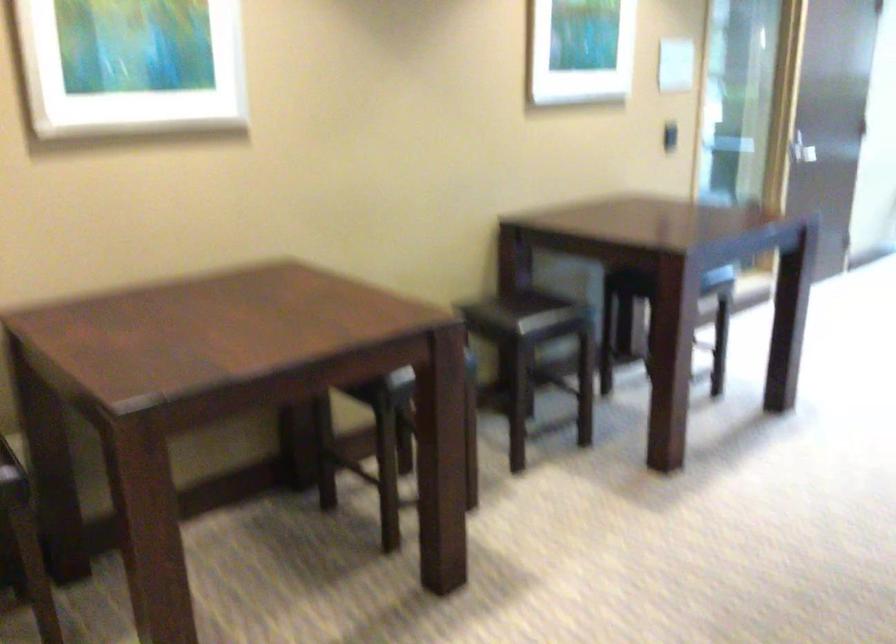
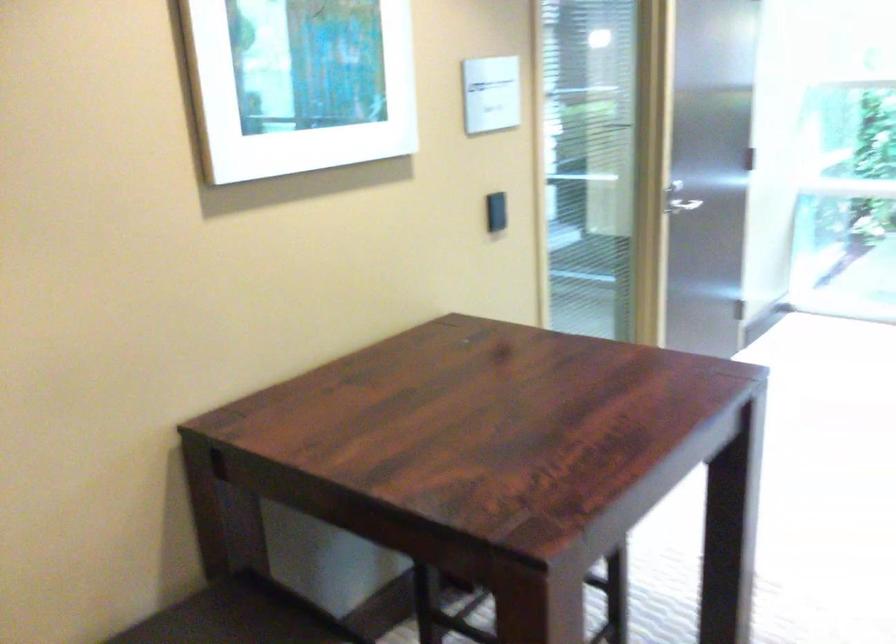
Question: In a continuous first-person perspective shot, in which direction is the camera moving?

Choices:
 (A) Left
 (B) Right
 (C) Forward
 (D) Backward

Answer: (C)